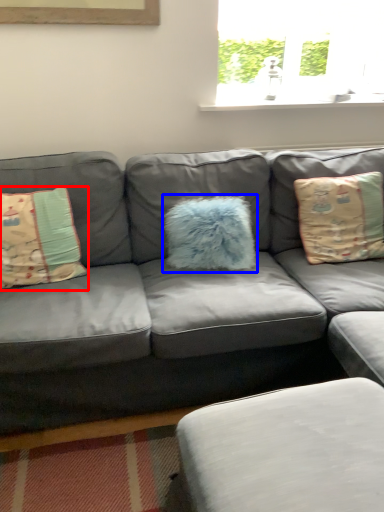
Question: Among these objects, which one is farthest to the camera, pillow (highlighted by a red box) or pillow (highlighted by a blue box)?

Choices:
 (A) pillow
 (B) pillow

Answer: (B)